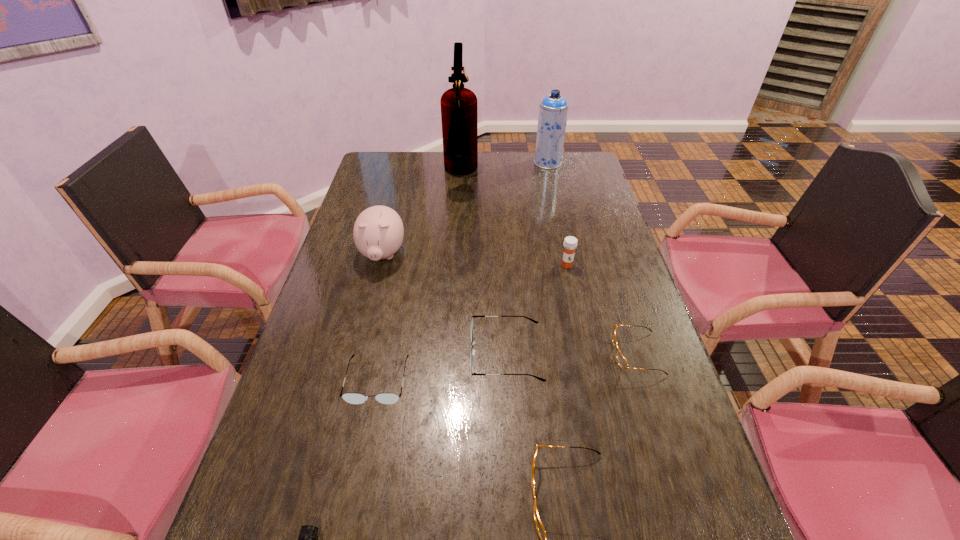
Locate an element on the screen. red fire extinguisher is located at coordinates (459, 115).

Identify the location of the tallest object. (459, 115).

Identify the location of aerosol can. pos(553,110).

At what (x,y) coordinates should I click in order to perform the action: click on blue aerosol can. Please return your answer as a coordinate pair (x, y). Looking at the image, I should click on (553, 110).

Find the location of `piggy bank`. piggy bank is located at coordinates (378, 232).

Where is `the sixth shortest object`? Image resolution: width=960 pixels, height=540 pixels. the sixth shortest object is located at coordinates (570, 243).

Locate an element on the screen. The width and height of the screenshot is (960, 540). the bigger black spectacles is located at coordinates (472, 351).

At what (x,y) coordinates should I click in order to perform the action: click on the left black spectacles. Please return your answer as a coordinate pair (x, y). The image size is (960, 540). Looking at the image, I should click on (353, 398).

Identify the location of the leftmost spectacles. (353, 398).

Locate an element on the screen. the farther gold spectacles is located at coordinates (622, 361).